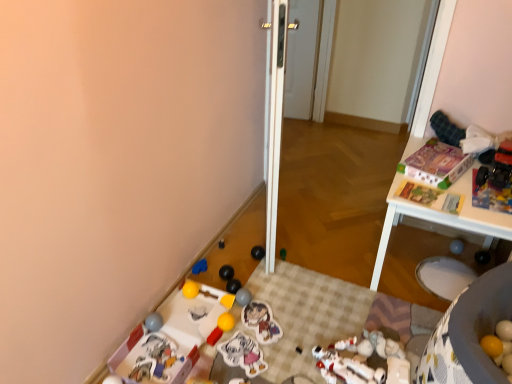
Where is `free location in front of matte plastic sticker at center, marked as the seventh toy in a right-to-left arrangement`? free location in front of matte plastic sticker at center, marked as the seventh toy in a right-to-left arrangement is located at coordinates (260, 362).